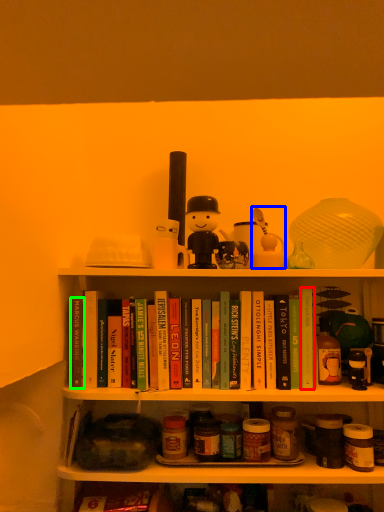
Question: Estimate the real-world distances between objects in this image. Which object is farther from paperback book (highlighted by a red box), toy (highlighted by a blue box) or paperback book (highlighted by a green box)?

Choices:
 (A) toy
 (B) paperback book

Answer: (B)